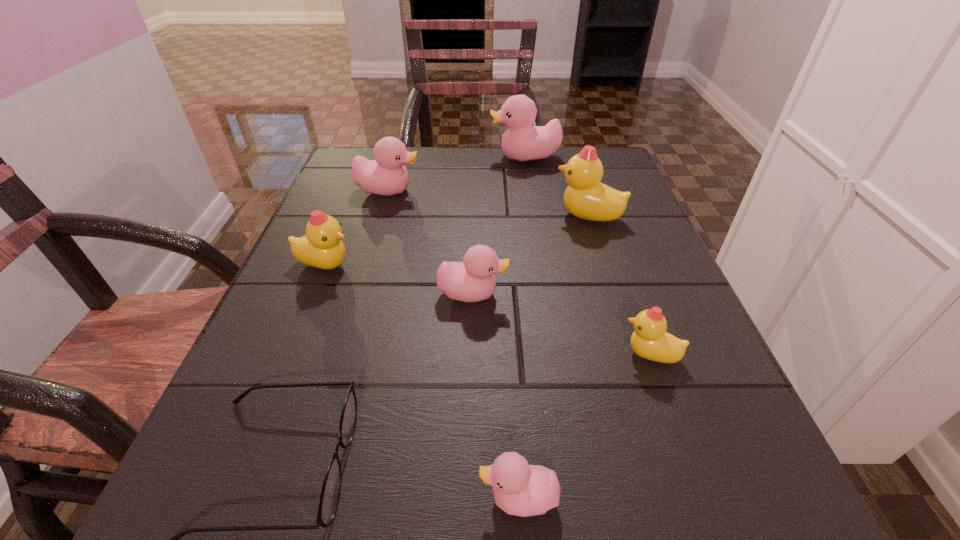
Where is `unoccupied position between the fifth farthest duckling and the sixth farthest object`? unoccupied position between the fifth farthest duckling and the sixth farthest object is located at coordinates (562, 324).

Image resolution: width=960 pixels, height=540 pixels. What are the coordinates of `vacant region between the smallest pink duckling and the third farthest pink duckling` in the screenshot? It's located at (495, 396).

At what (x,y) coordinates should I click in order to perform the action: click on empty space that is in between the sixth nearest object and the second nearest duckling. Please return your answer as a coordinate pair (x, y). The height and width of the screenshot is (540, 960). Looking at the image, I should click on (619, 285).

Where is `free area in between the fifth nearest object and the sixth farthest duckling`? This screenshot has width=960, height=540. free area in between the fifth nearest object and the sixth farthest duckling is located at coordinates (488, 310).

Find the location of `blank region between the leftmost pink duckling and the smallest pink duckling`. blank region between the leftmost pink duckling and the smallest pink duckling is located at coordinates (453, 345).

Image resolution: width=960 pixels, height=540 pixels. Find the location of `free space between the fifth nearest duckling and the second farthest object`. free space between the fifth nearest duckling and the second farthest object is located at coordinates (489, 204).

The image size is (960, 540). Identify the location of free space that is in between the farthest object and the third nearest pink duckling. (457, 174).

Point out which object is positioned as the sixth nearest to the nearest yellow duckling. Please provide its 2D coordinates. Your answer should be formatted as a tuple, i.e. [(x, y)], where the tuple contains the x and y coordinates of a point satisfying the conditions above.

[(386, 175)]

Identify which object is the fifth closest to the nearest yellow duckling. Please provide its 2D coordinates. Your answer should be formatted as a tuple, i.e. [(x, y)], where the tuple contains the x and y coordinates of a point satisfying the conditions above.

[(321, 247)]

The width and height of the screenshot is (960, 540). What are the coordinates of `duckling that is the closest to the farthest yellow duckling` in the screenshot? It's located at (521, 142).